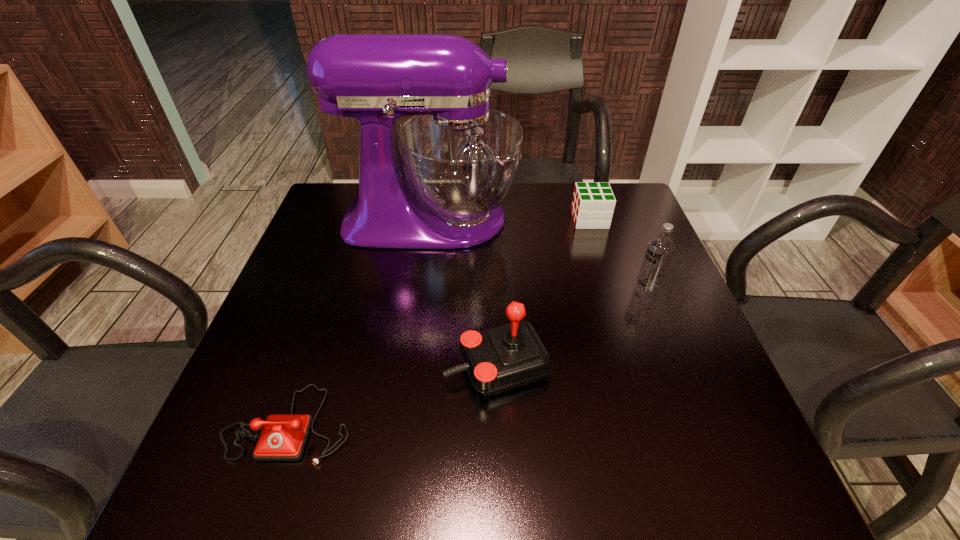
Select which object appears as the closest to the tallest object. Please provide its 2D coordinates. Your answer should be formatted as a tuple, i.e. [(x, y)], where the tuple contains the x and y coordinates of a point satisfying the conditions above.

[(593, 204)]

Where is `vacant area that satisfies the following two spatial constraints: 1. at the bowl opening of the joystick; 2. on the left side of the mixer`? vacant area that satisfies the following two spatial constraints: 1. at the bowl opening of the joystick; 2. on the left side of the mixer is located at coordinates (411, 366).

The height and width of the screenshot is (540, 960). I want to click on free space that satisfies the following two spatial constraints: 1. on the front label of the vodka; 2. on the dial of the shortest object, so click(703, 423).

The image size is (960, 540). What are the coordinates of `vacant area in the image that satisfies the following two spatial constraints: 1. on the red face of the fourth object from left to right; 2. on the dial of the telephone` in the screenshot? It's located at (653, 423).

The height and width of the screenshot is (540, 960). What are the coordinates of `free location that satisfies the following two spatial constraints: 1. on the red face of the cube; 2. on the dial of the telephone` in the screenshot? It's located at (653, 423).

This screenshot has width=960, height=540. Identify the location of vacant space that satisfies the following two spatial constraints: 1. on the front label of the vodka; 2. on the dial of the shortest object. (703, 423).

Where is `free space in the image that satisfies the following two spatial constraints: 1. on the red face of the second shortest object; 2. on the front side of the joystick`? This screenshot has height=540, width=960. free space in the image that satisfies the following two spatial constraints: 1. on the red face of the second shortest object; 2. on the front side of the joystick is located at coordinates point(635,366).